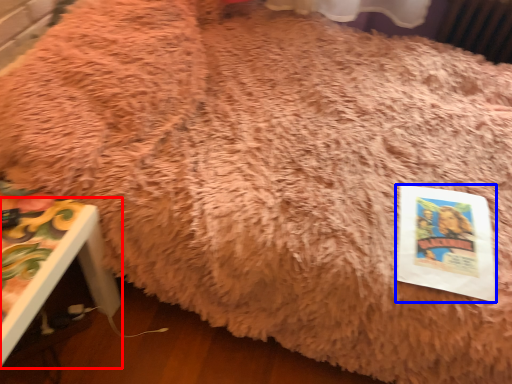
Question: Which object appears closest to the camera in this image, furniture (highlighted by a red box) or paperback book (highlighted by a blue box)?

Choices:
 (A) furniture
 (B) paperback book

Answer: (A)